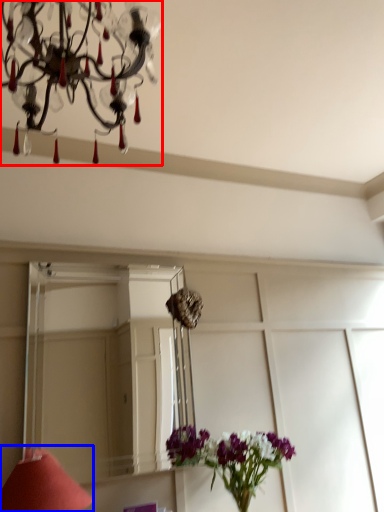
Question: Which of the following is the closest to the observer, lamp (highlighted by a red box) or table lamp (highlighted by a blue box)?

Choices:
 (A) lamp
 (B) table lamp

Answer: (A)